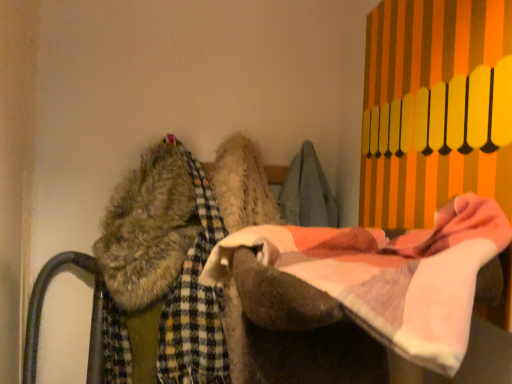
What do you see at coordinates (390, 274) in the screenshot?
I see `pink velvety towel at center` at bounding box center [390, 274].

This screenshot has height=384, width=512. Find the location of `pink velvety towel at center`. pink velvety towel at center is located at coordinates (390, 274).

Locate an element on the screen. This screenshot has width=512, height=384. pink velvety towel at center is located at coordinates (390, 274).